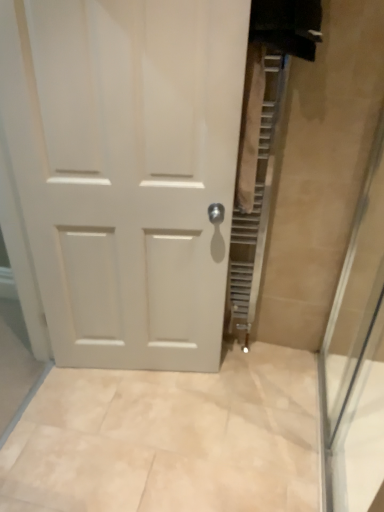
Question: Does transparent glass shower door at right have a larger size compared to white matte door at center?

Choices:
 (A) yes
 (B) no

Answer: (B)

Question: Does transparent glass shower door at right contain white matte door at center?

Choices:
 (A) no
 (B) yes

Answer: (A)

Question: Considering the relative sizes of transparent glass shower door at right and white matte door at center in the image provided, is transparent glass shower door at right thinner than white matte door at center?

Choices:
 (A) no
 (B) yes

Answer: (B)

Question: Is transparent glass shower door at right not inside white matte door at center?

Choices:
 (A) no
 (B) yes

Answer: (B)

Question: Considering the relative sizes of transparent glass shower door at right and white matte door at center in the image provided, is transparent glass shower door at right smaller than white matte door at center?

Choices:
 (A) yes
 (B) no

Answer: (A)

Question: From a real-world perspective, is transparent glass shower door at right on white matte door at center?

Choices:
 (A) yes
 (B) no

Answer: (B)

Question: From a real-world perspective, is white matte door at center under transparent glass shower door at right?

Choices:
 (A) yes
 (B) no

Answer: (B)

Question: Would you consider white matte door at center to be distant from transparent glass shower door at right?

Choices:
 (A) yes
 (B) no

Answer: (B)

Question: Is white matte door at center shorter than transparent glass shower door at right?

Choices:
 (A) no
 (B) yes

Answer: (A)

Question: Does white matte door at center come behind transparent glass shower door at right?

Choices:
 (A) yes
 (B) no

Answer: (A)

Question: Considering the relative sizes of white matte door at center and transparent glass shower door at right in the image provided, is white matte door at center smaller than transparent glass shower door at right?

Choices:
 (A) no
 (B) yes

Answer: (A)

Question: Can you confirm if white matte door at center is bigger than transparent glass shower door at right?

Choices:
 (A) yes
 (B) no

Answer: (A)

Question: Is point (357, 418) closer or farther from the camera than point (203, 179)?

Choices:
 (A) closer
 (B) farther

Answer: (B)